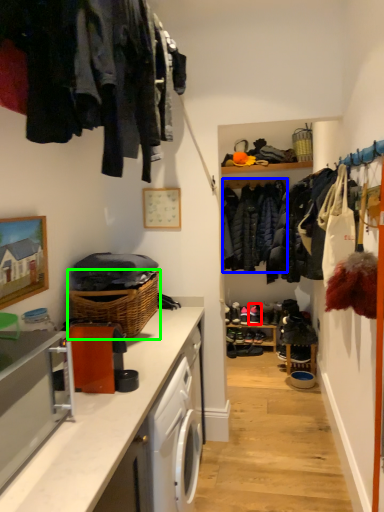
Question: Estimate the real-world distances between objects in this image. Which object is farther from shoe (highlighted by a red box), clothing (highlighted by a blue box) or basket (highlighted by a green box)?

Choices:
 (A) clothing
 (B) basket

Answer: (B)